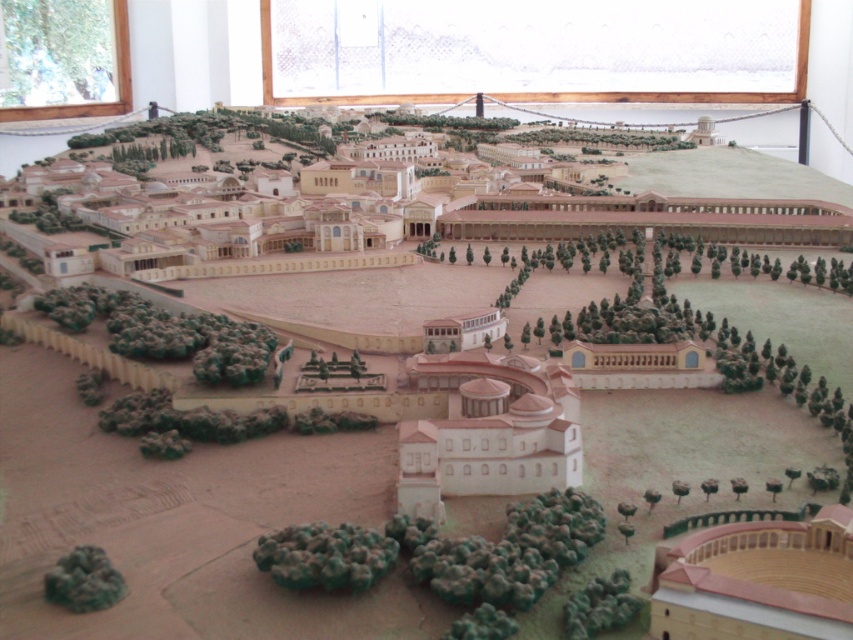
Looking at this image, which is above, green matte tree at upper left or green matte tree at lower right?

green matte tree at upper left is above.

Is green matte tree at upper left below green matte tree at lower right?

No, green matte tree at upper left is not below green matte tree at lower right.

The image size is (853, 640). Describe the element at coordinates (56, 52) in the screenshot. I see `green matte tree at upper left` at that location.

I want to click on green matte tree at upper left, so pos(56,52).

Is light brown clay amphitheater at lower right thinner than green matte tree at upper left?

Yes, light brown clay amphitheater at lower right is thinner than green matte tree at upper left.

Is light brown clay amphitheater at lower right further to camera compared to green matte tree at upper left?

No, it is not.

The width and height of the screenshot is (853, 640). What do you see at coordinates (758, 580) in the screenshot?
I see `light brown clay amphitheater at lower right` at bounding box center [758, 580].

Find the location of a particular element. light brown clay amphitheater at lower right is located at coordinates (758, 580).

Is light brown clay amphitheater at lower right bigger than green matte trees at lower left?

No.

Between light brown clay amphitheater at lower right and green matte trees at lower left, which one is positioned lower?

light brown clay amphitheater at lower right is below.

Which is behind, point (836, 605) or point (251, 340)?

Point (251, 340)

Locate an element on the screen. Image resolution: width=853 pixels, height=640 pixels. light brown clay amphitheater at lower right is located at coordinates (758, 580).